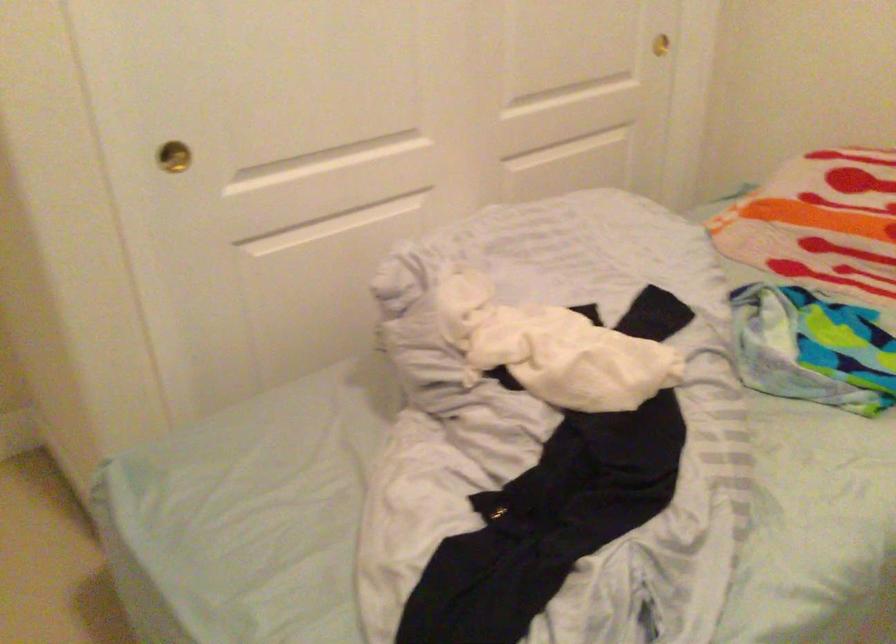
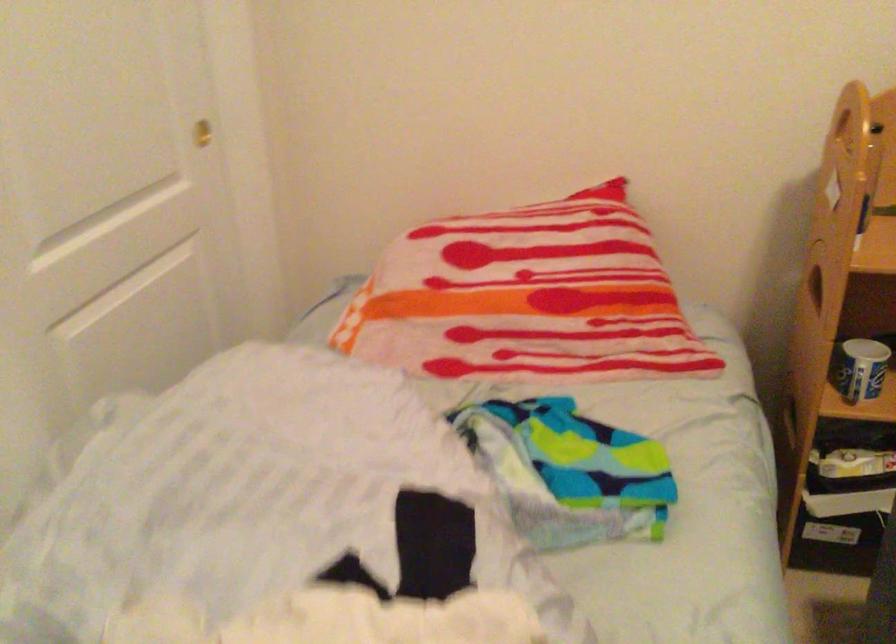
Question: The first image is from the beginning of the video and the second image is from the end. How did the camera likely rotate when shooting the video?

Choices:
 (A) Left
 (B) Right
 (C) Up
 (D) Down

Answer: (B)